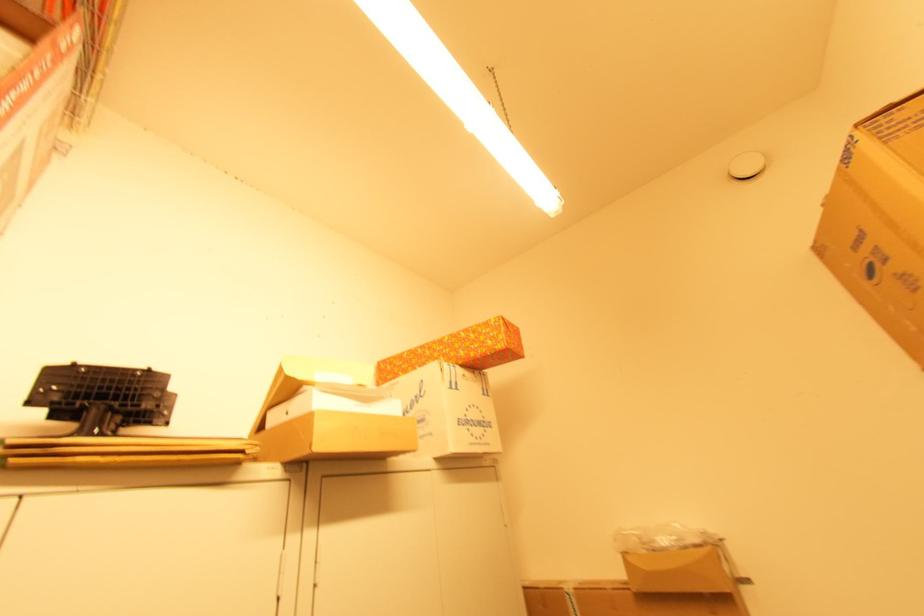
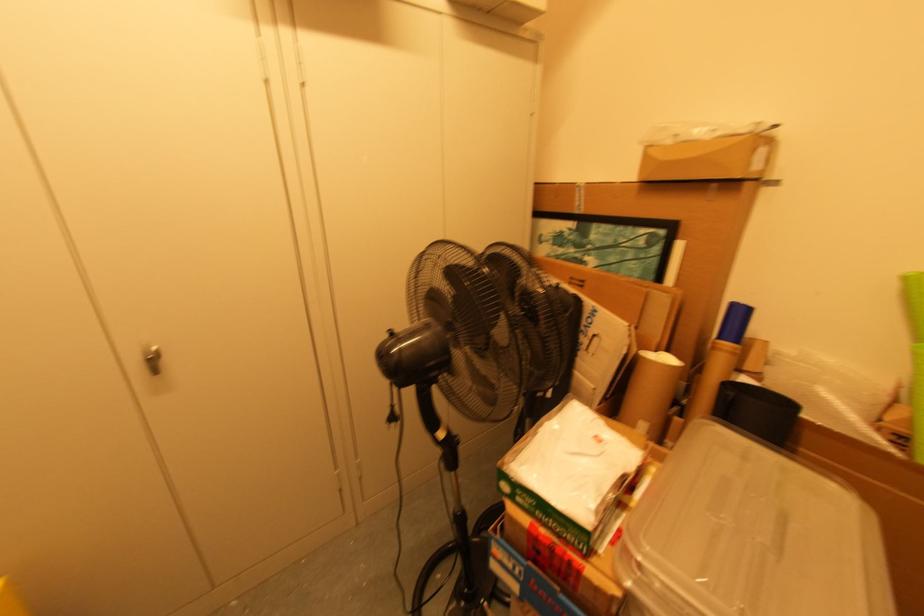
First-person continuous shooting, in which direction is the camera rotating?

The camera's rotation is toward left-down.